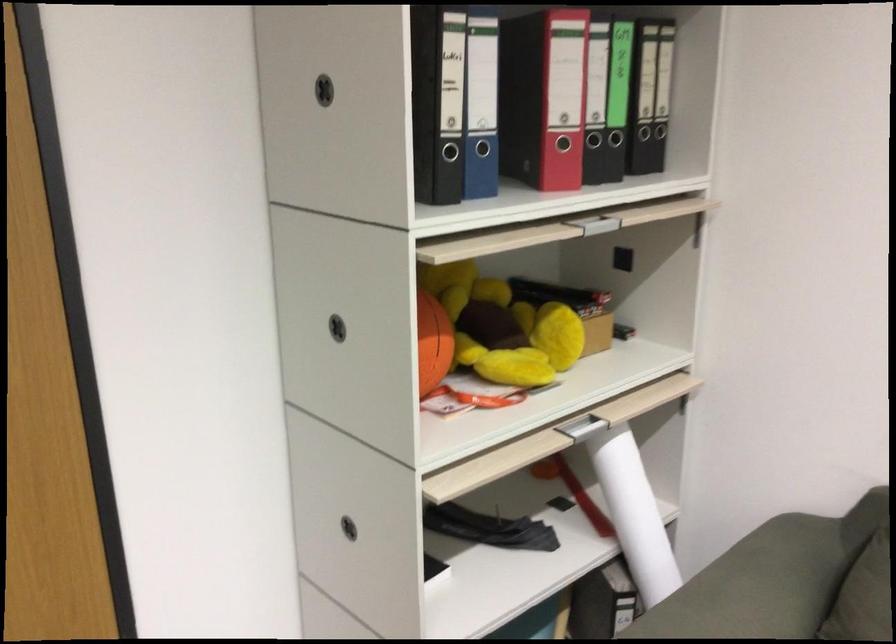
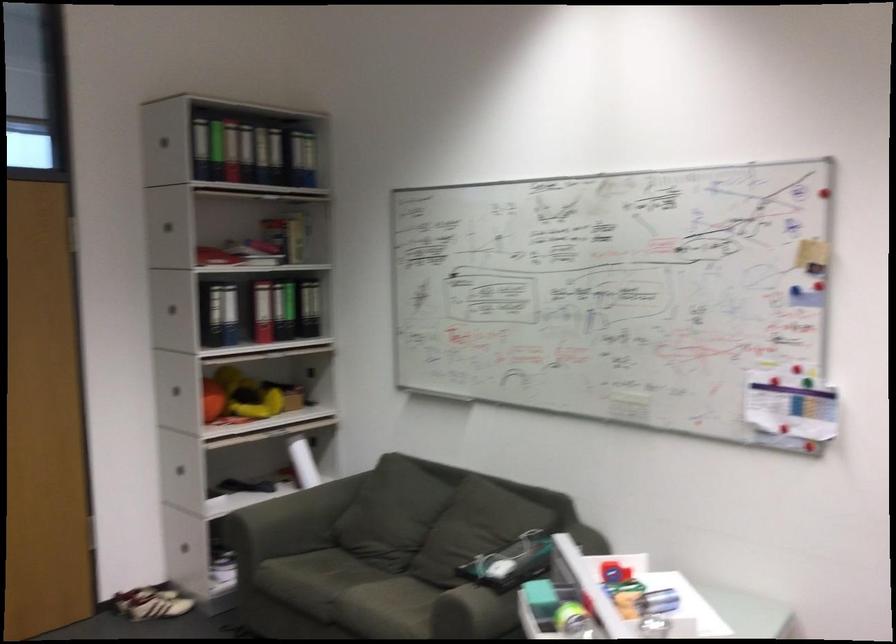
What movement of the cameraman would produce the second image?

The cameraman moved toward right, backward.